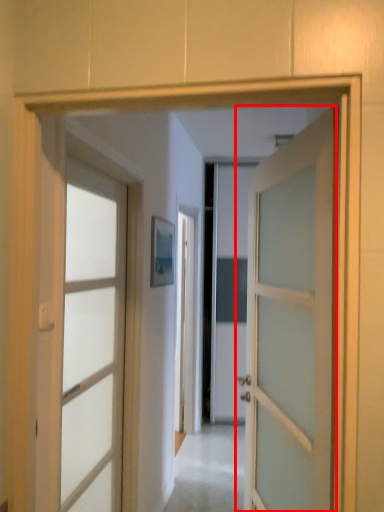
Question: Where is door (annotated by the red box) located in relation to door in the image?

Choices:
 (A) left
 (B) right

Answer: (B)